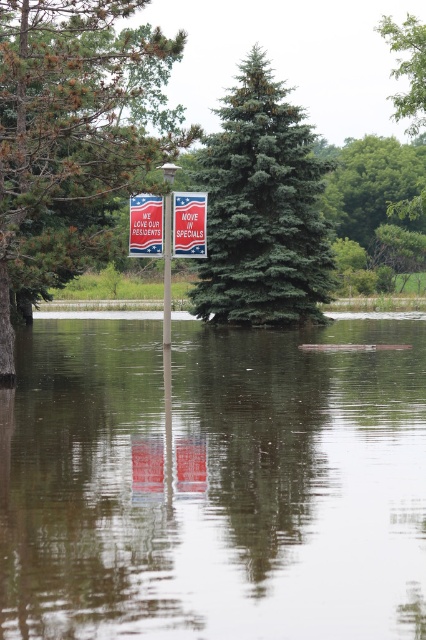
You are a delivery person trying to avoid getting your packages wet. You see the red plastic sign at center and the metallic silver sign at center in the flooded area. Which sign should you aim to stay closer to in order to avoid the water?

The red plastic sign at center is much taller than the metallic silver sign at center, so staying closer to the red plastic sign at center would provide higher ground and help avoid the water.

You are a delivery person trying to avoid getting your packages wet. The red plastic sign at center and the metallic silver sign at center are both in the flooded area. Which sign should you stay closer to if you want to avoid deeper water?

The red plastic sign at center is smaller than metallic silver sign at center, so the deeper water is likely around the larger metallic silver sign at center. To avoid deeper water, stay closer to the red plastic sign at center.

You are standing in the flooded area and need to place a floating marker exactly at the clear water at center. According to the coordinates provided, where should you position it?

The clear water at center should be positioned at coordinates point (213, 483).